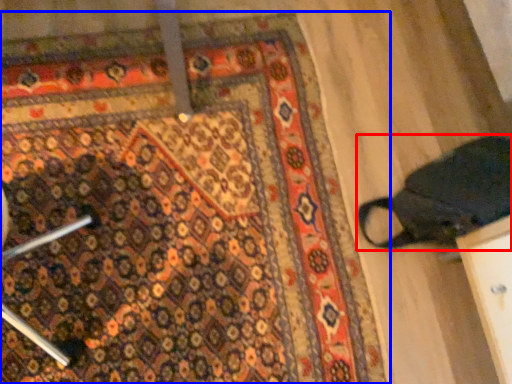
Question: Which point is closer to the camera, footwear (highlighted by a red box) or mat (highlighted by a blue box)?

Choices:
 (A) footwear
 (B) mat

Answer: (A)